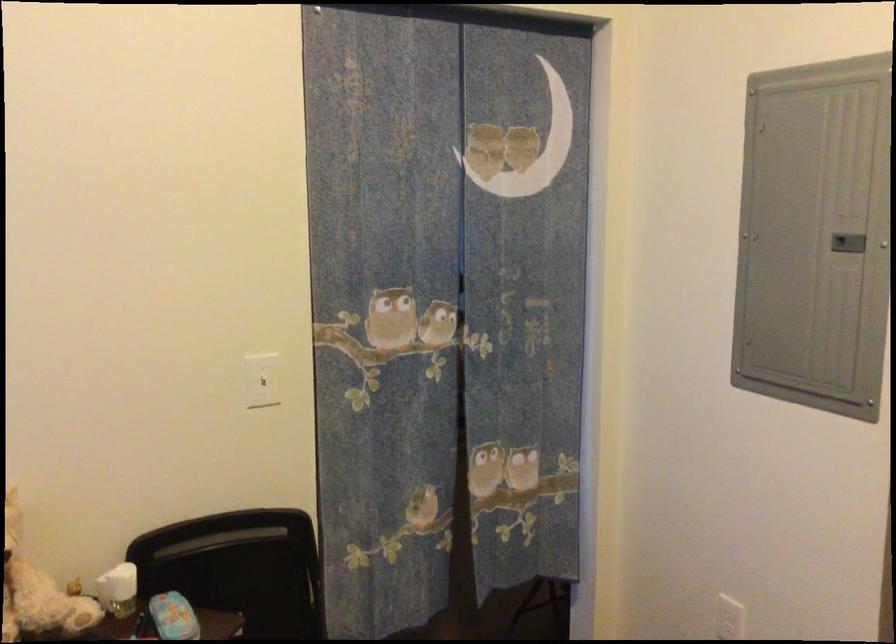
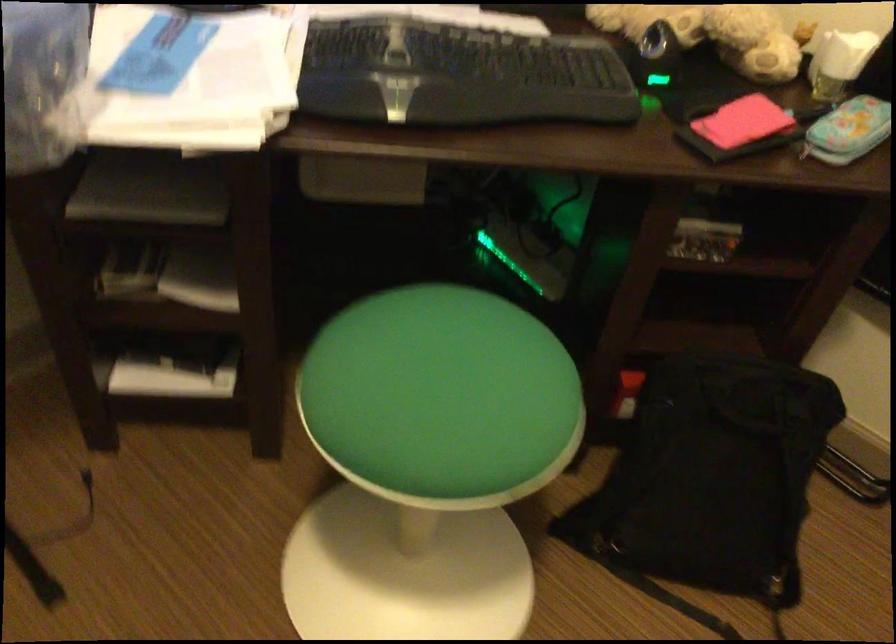
How did the camera likely rotate?

The camera's rotation is toward left-down.